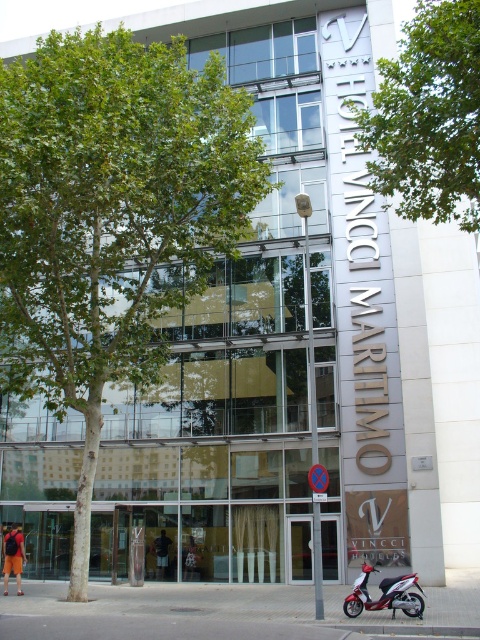
Question: Does green leafy tree at center appear under green leafy tree at upper center?

Choices:
 (A) yes
 (B) no

Answer: (A)

Question: Which point is farther to the camera?

Choices:
 (A) green leafy tree at upper center
 (B) green leafy tree at center

Answer: (B)

Question: Estimate the real-world distances between objects in this image. Which object is closer to the green leafy tree at center?

Choices:
 (A) green leafy tree at upper center
 (B) metallic red scooter at lower right

Answer: (A)

Question: Is green leafy tree at upper center wider than metallic red scooter at lower right?

Choices:
 (A) no
 (B) yes

Answer: (B)

Question: Which of the following is the closest to the observer?

Choices:
 (A) (385, 596)
 (B) (36, 278)

Answer: (A)

Question: Is green leafy tree at center bigger than metallic red scooter at lower right?

Choices:
 (A) no
 (B) yes

Answer: (B)